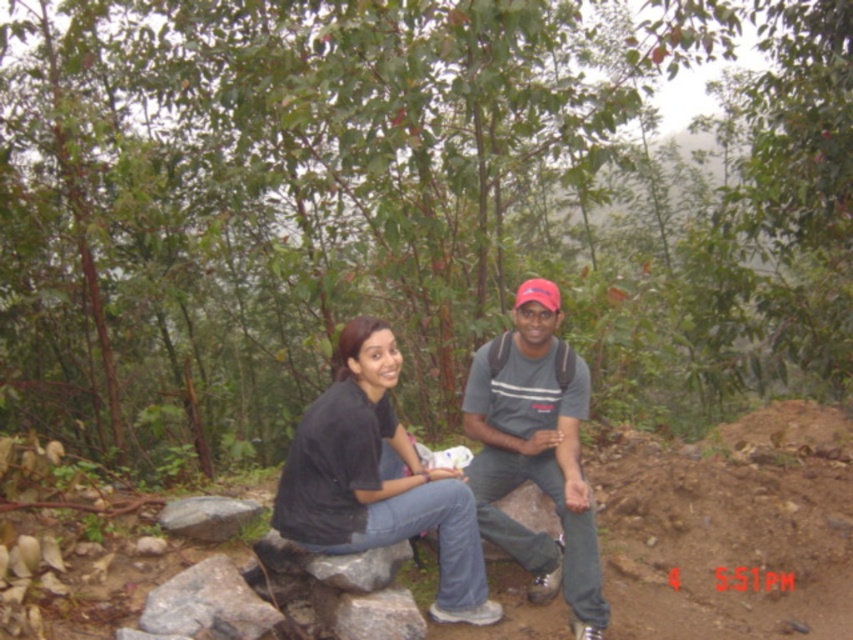
Question: Considering the relative positions of black cotton shirt at center and gray rough rock at lower left in the image provided, where is black cotton shirt at center located with respect to gray rough rock at lower left?

Choices:
 (A) below
 (B) above

Answer: (B)

Question: Which point is closer to the camera?

Choices:
 (A) black cotton shirt at center
 (B) gray rough rock at lower left
 (C) matte gray t-shirt at center

Answer: (A)

Question: Does black cotton shirt at center appear over matte gray t-shirt at center?

Choices:
 (A) no
 (B) yes

Answer: (A)

Question: Is matte gray t-shirt at center smaller than gray rough rock at lower left?

Choices:
 (A) no
 (B) yes

Answer: (A)

Question: Which point appears farthest from the camera in this image?

Choices:
 (A) (592, 593)
 (B) (224, 500)

Answer: (B)

Question: Which of the following is the farthest from the observer?

Choices:
 (A) matte gray t-shirt at center
 (B) gray rough rock at lower left

Answer: (B)